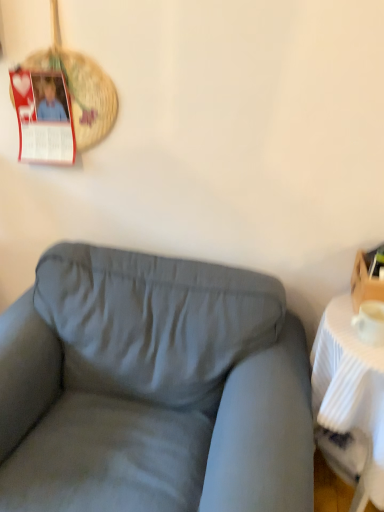
Question: Is woven straw basket at upper left directly adjacent to wooden box at right?

Choices:
 (A) no
 (B) yes

Answer: (A)

Question: From the image's perspective, is woven straw basket at upper left located beneath wooden box at right?

Choices:
 (A) no
 (B) yes

Answer: (A)

Question: From a real-world perspective, is woven straw basket at upper left physically below wooden box at right?

Choices:
 (A) no
 (B) yes

Answer: (A)

Question: From a real-world perspective, is woven straw basket at upper left located higher than wooden box at right?

Choices:
 (A) no
 (B) yes

Answer: (B)

Question: Does woven straw basket at upper left appear on the left side of wooden box at right?

Choices:
 (A) yes
 (B) no

Answer: (A)

Question: Is woven straw basket at upper left oriented away from wooden box at right?

Choices:
 (A) yes
 (B) no

Answer: (B)

Question: Would you say woven straw basket at upper left contains white ribbed table at right?

Choices:
 (A) yes
 (B) no

Answer: (B)

Question: From a real-world perspective, is woven straw basket at upper left on top of white ribbed table at right?

Choices:
 (A) yes
 (B) no

Answer: (A)

Question: Is woven straw basket at upper left wider than white ribbed table at right?

Choices:
 (A) no
 (B) yes

Answer: (A)

Question: Is woven straw basket at upper left oriented towards white ribbed table at right?

Choices:
 (A) no
 (B) yes

Answer: (A)

Question: Can you confirm if woven straw basket at upper left is positioned to the right of white ribbed table at right?

Choices:
 (A) yes
 (B) no

Answer: (B)

Question: Is woven straw basket at upper left at the left side of white ribbed table at right?

Choices:
 (A) yes
 (B) no

Answer: (A)

Question: Is white ribbed table at right positioned beyond the bounds of suede gray couch at center?

Choices:
 (A) yes
 (B) no

Answer: (A)